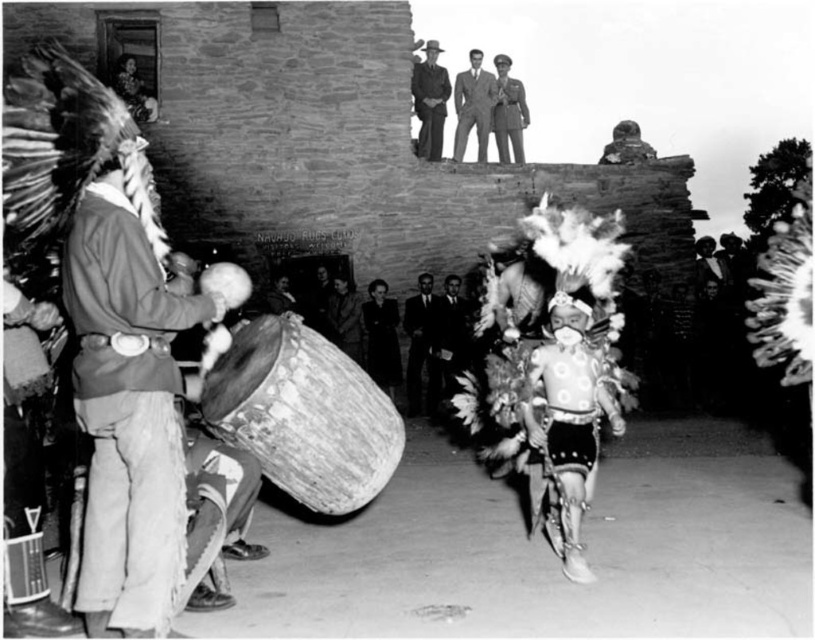
You are a photographer at the event and want to take a photo that includes both the dark suit at center and the smooth leather jacket at upper center. Based on their positions, which object should you focus on first to ensure both are in the frame?

The dark suit at center is located below the smooth leather jacket at upper center, so you should focus on the smooth leather jacket at upper center first to ensure both are in the frame.